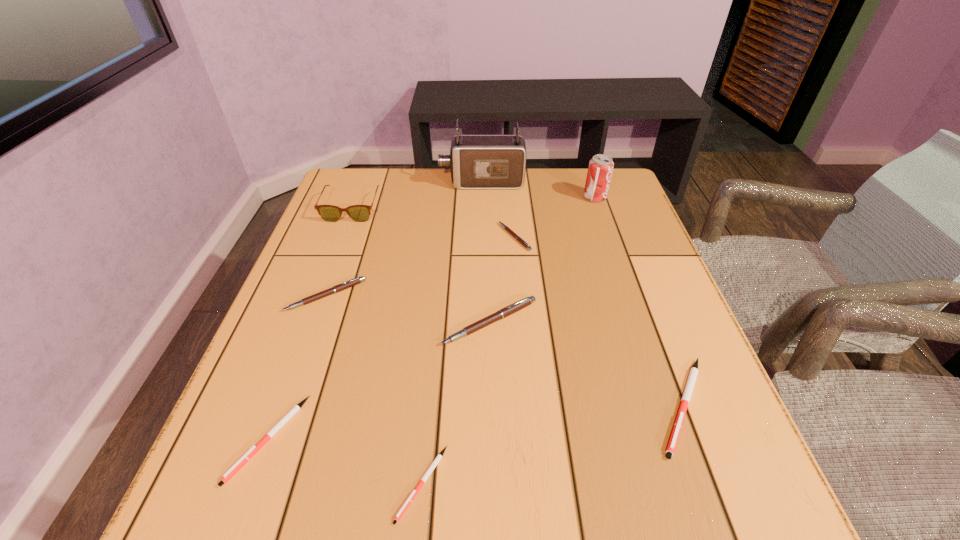
I want to click on spectacles at the left edge, so click(x=360, y=213).

I want to click on soda can present at the right edge, so click(x=600, y=169).

Identify the location of pen that is at the right edge. (687, 393).

This screenshot has width=960, height=540. What are the coordinates of `object at the far left corner` in the screenshot? It's located at (360, 213).

At what (x,y) coordinates should I click in order to perform the action: click on object that is at the near left corner. Please return your answer as a coordinate pair (x, y). Looking at the image, I should click on (296, 408).

This screenshot has height=540, width=960. I want to click on object that is at the far right corner, so click(600, 169).

This screenshot has width=960, height=540. I want to click on free region at the far edge, so click(x=536, y=195).

This screenshot has width=960, height=540. In order to click on vacant space at the near edge of the desktop in this screenshot , I will do `click(641, 493)`.

This screenshot has height=540, width=960. I want to click on blank space at the left edge, so [x=233, y=408].

Locate an element on the screen. The height and width of the screenshot is (540, 960). vacant space at the right edge is located at coordinates (642, 265).